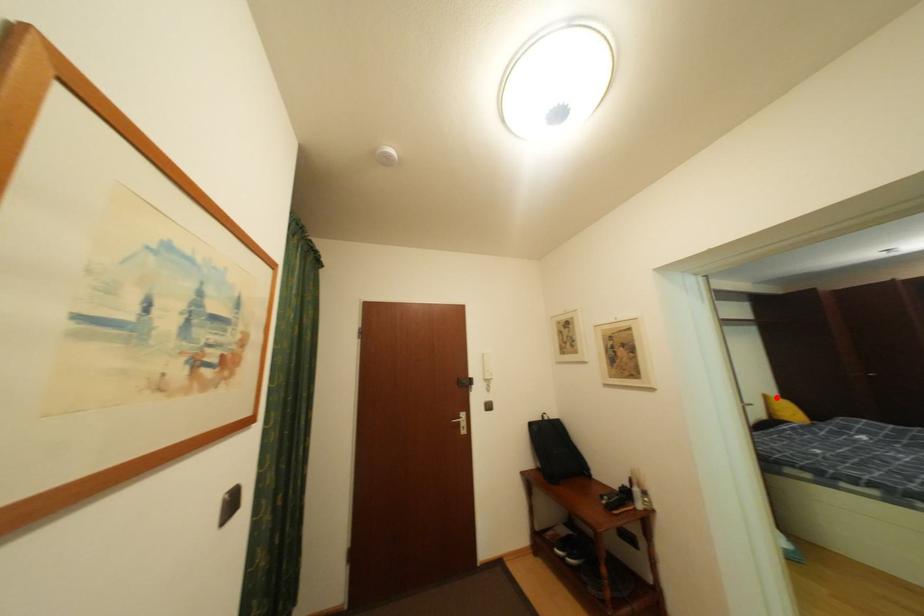
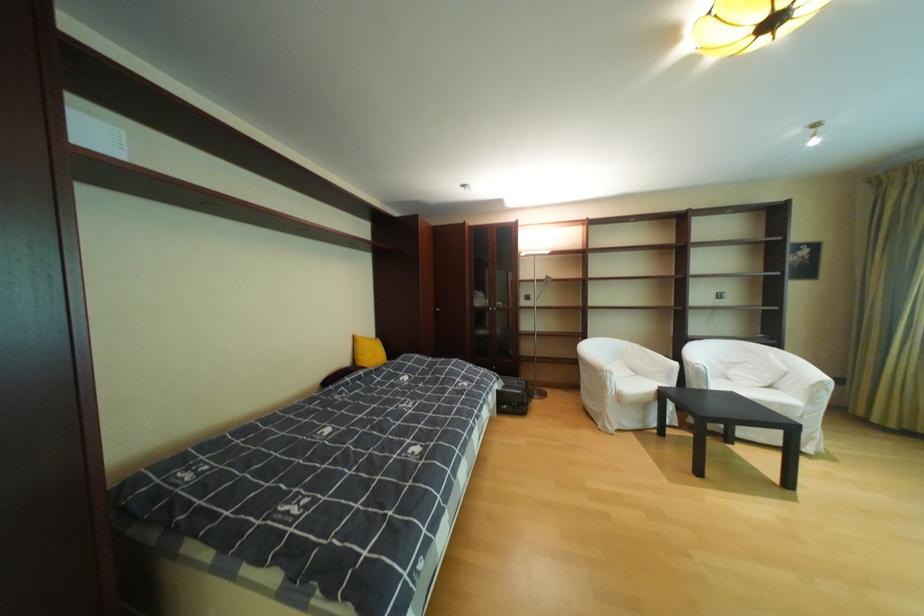
The point at the highlighted location is marked in the first image. Where is the corresponding point in the second image?

(367, 339)